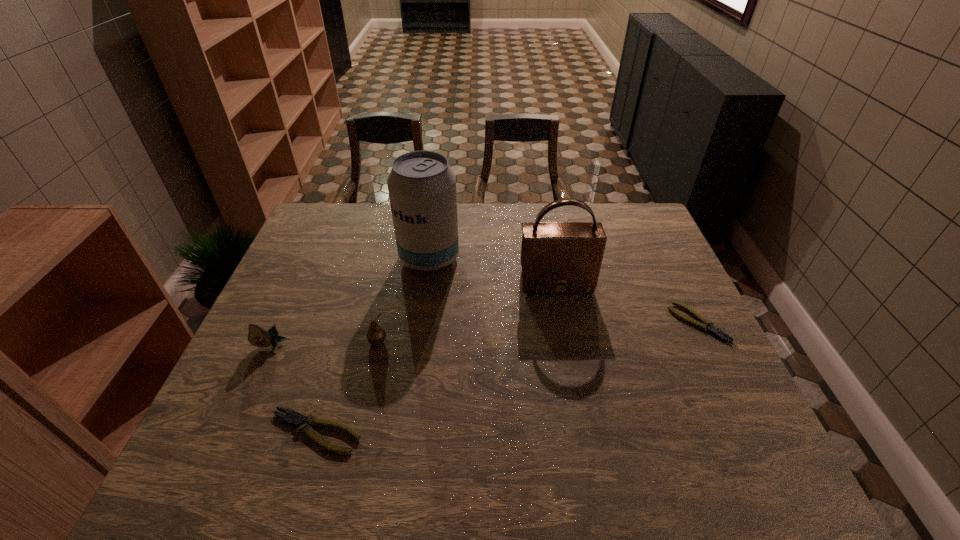
The width and height of the screenshot is (960, 540). I want to click on object situated at the near left corner, so click(x=296, y=419).

Where is `free region at the far edge`? The image size is (960, 540). free region at the far edge is located at coordinates (460, 221).

In the image, there is a desktop. At what (x,y) coordinates should I click in order to perform the action: click on vacant space at the near edge. Please return your answer as a coordinate pair (x, y). Looking at the image, I should click on (415, 427).

Image resolution: width=960 pixels, height=540 pixels. In order to click on free space at the left edge of the desktop in this screenshot , I will do `click(284, 346)`.

The width and height of the screenshot is (960, 540). Find the location of `vacant space at the right edge of the desktop`. vacant space at the right edge of the desktop is located at coordinates (653, 288).

You are a GUI agent. You are given a task and a screenshot of the screen. Output one action in this format:
    pyautogui.click(x=<x>, y=<y>)
    Task: Click on the vacant space at the near left corner of the desktop
    
    Given the screenshot: What is the action you would take?
    pyautogui.click(x=236, y=430)

The height and width of the screenshot is (540, 960). In the image, there is a desktop. Find the location of `free space at the far right corner`. free space at the far right corner is located at coordinates (603, 204).

Where is `free spot between the fifth object from left to right and the farther pliers`? The width and height of the screenshot is (960, 540). free spot between the fifth object from left to right and the farther pliers is located at coordinates (627, 302).

Identify the location of unoccupied area between the right pliers and the avocado. This screenshot has width=960, height=540. (484, 335).

Identify the location of free area in between the pear and the fifth tallest object. (347, 387).